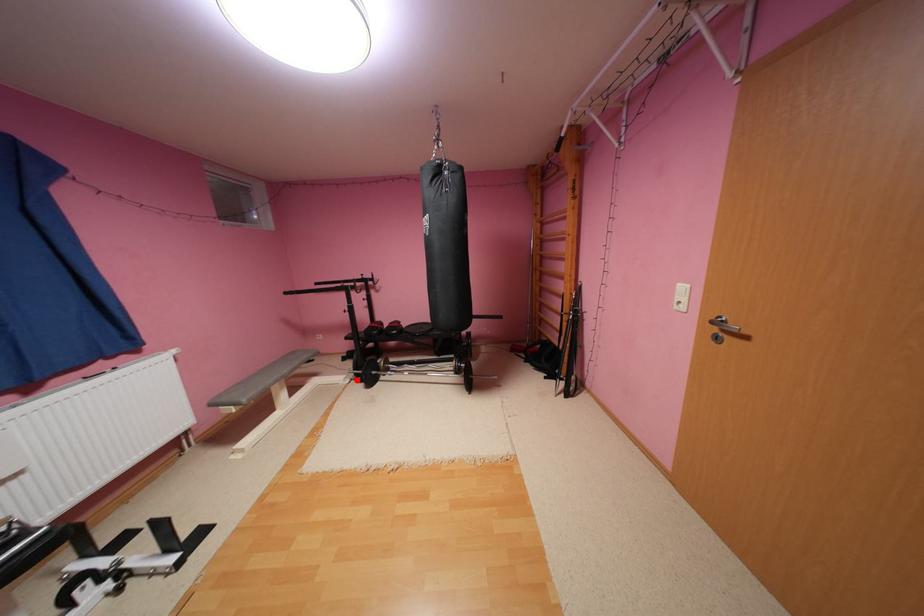
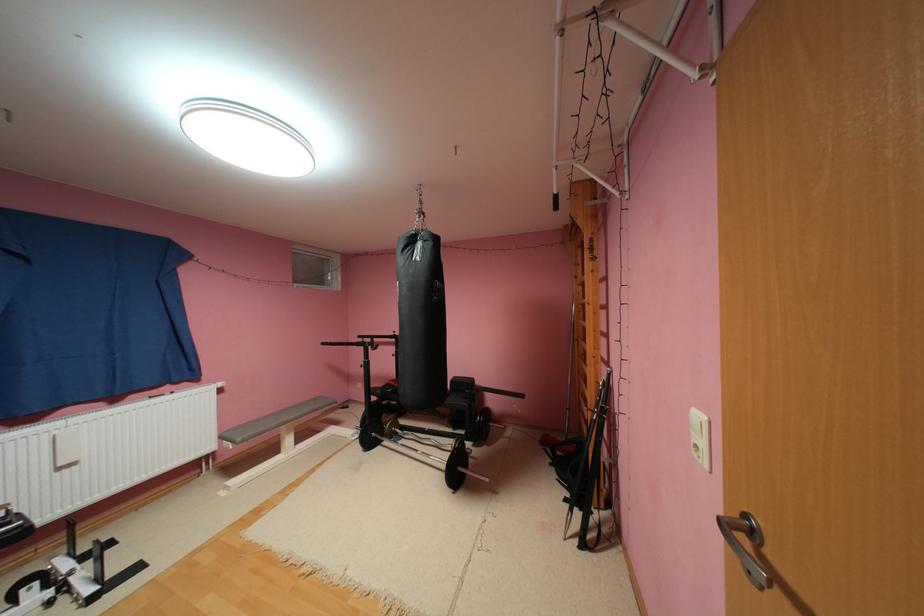
Question: A red point is marked in image1. In image2, is the corresponding 3D point closer to the camera or farther? Reply with the corresponding letter.

Choices:
 (A) The corresponding 3D point is closer.
 (B) The corresponding 3D point is farther.

Answer: (A)